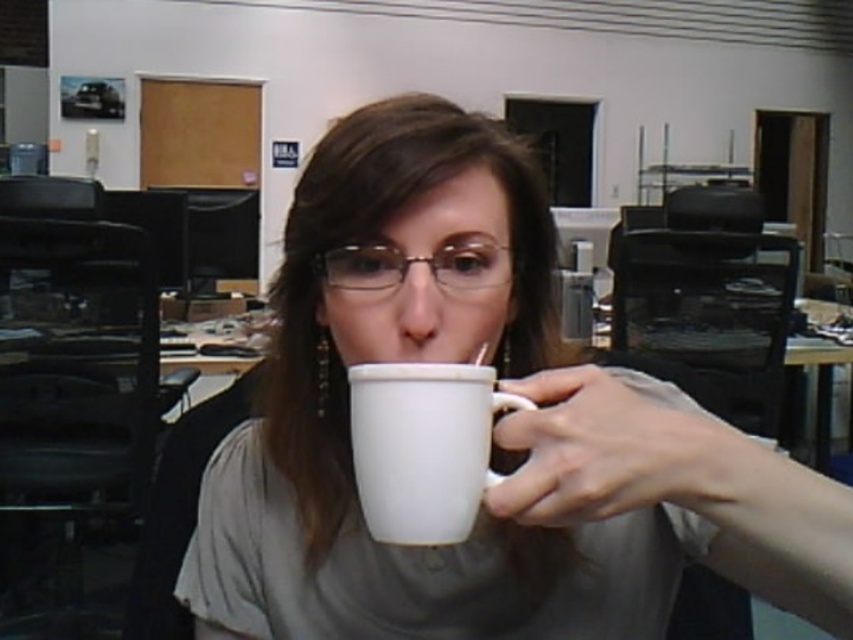
From the picture: Is white glossy mug at center closer to the viewer compared to white ceramic mug at center?

Yes, it is in front of white ceramic mug at center.

Is white glossy mug at center thinner than white ceramic mug at center?

No.

Who is more distant from viewer, [688,509] or [479,460]?

The point [688,509] is behind.

Identify the location of white glossy mug at center. (494, 428).